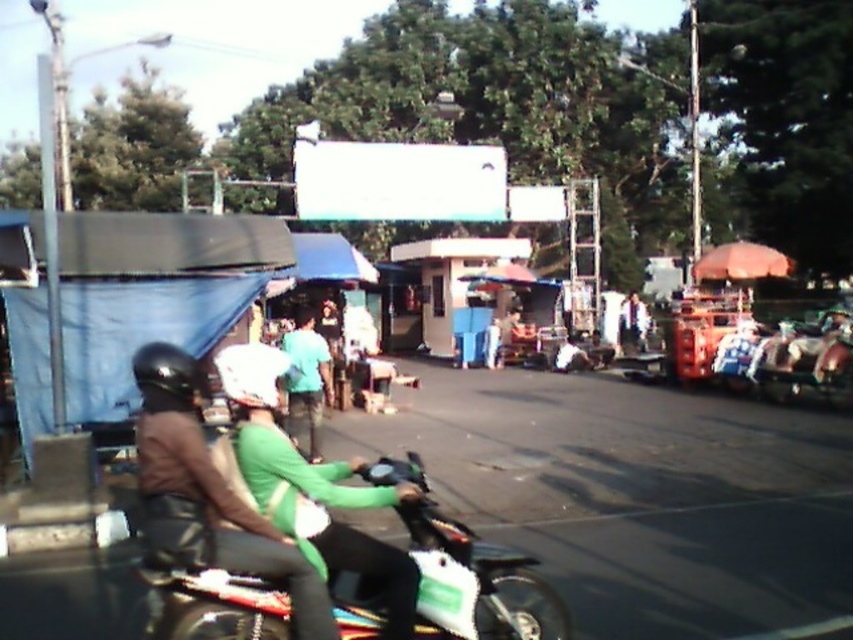
Does matte black helmet at left lie in front of white matte helmet at center?

Yes, matte black helmet at left is closer to the viewer.

Does matte black helmet at left come behind white matte helmet at center?

No, matte black helmet at left is in front of white matte helmet at center.

Is point (293, 570) more distant than point (271, 380)?

No, it is not.

Locate an element on the screen. Image resolution: width=853 pixels, height=640 pixels. matte black helmet at left is located at coordinates 207,493.

Which is above, matte black helmet at left or green matte shirt at center?

green matte shirt at center

Can you confirm if matte black helmet at left is shorter than green matte shirt at center?

Correct, matte black helmet at left is not as tall as green matte shirt at center.

Is point (149, 454) closer to viewer compared to point (306, 378)?

Yes.

At what (x,y) coordinates should I click in order to perform the action: click on matte black helmet at left. Please return your answer as a coordinate pair (x, y). This screenshot has width=853, height=640. Looking at the image, I should click on (207, 493).

Measure the distance between matte black helmet at left and black matte helmet at left.

A distance of 12.65 inches exists between matte black helmet at left and black matte helmet at left.

Is matte black helmet at left below black matte helmet at left?

Yes, matte black helmet at left is below black matte helmet at left.

Locate an element on the screen. This screenshot has height=640, width=853. matte black helmet at left is located at coordinates (x=207, y=493).